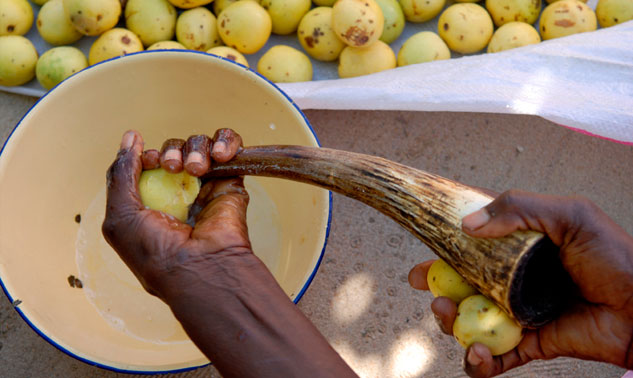
The image size is (633, 378). In order to click on bowl in this screenshot , I will do `click(47, 154)`.